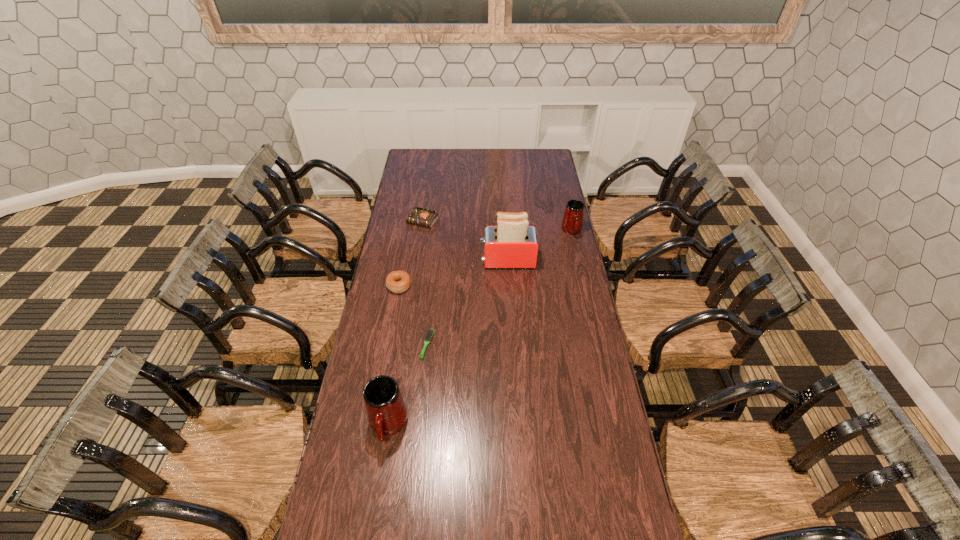
You are a GUI agent. You are given a task and a screenshot of the screen. Output one action in this format:
    pyautogui.click(x=<x>, y=<y>)
    Task: Click on the free spot between the hairbrush and the diary
    
    Given the screenshot: What is the action you would take?
    pyautogui.click(x=424, y=284)

Where is `free space that is in between the left mug and the fourth shortest object`? This screenshot has width=960, height=540. free space that is in between the left mug and the fourth shortest object is located at coordinates (480, 329).

Find the location of `free point between the diary and the third nearest object`. free point between the diary and the third nearest object is located at coordinates (411, 254).

The height and width of the screenshot is (540, 960). I want to click on free space between the shortest object and the fourth nearest object, so tap(468, 303).

Where is `free spot between the rightmost object and the shortest object`? The image size is (960, 540). free spot between the rightmost object and the shortest object is located at coordinates (499, 288).

Image resolution: width=960 pixels, height=540 pixels. Find the location of `vacant area between the third nearest object and the diary`. vacant area between the third nearest object and the diary is located at coordinates (411, 254).

You are a GUI agent. You are given a task and a screenshot of the screen. Output one action in this format:
    pyautogui.click(x=<x>, y=<y>)
    Task: Click on the object that stands as the closest to the second object from right to left
    This screenshot has width=960, height=540.
    Given the screenshot: What is the action you would take?
    pyautogui.click(x=572, y=223)

The image size is (960, 540). I want to click on the closest object relative to the bagel, so click(x=429, y=333).

Identify the location of free spot that satisfies the following two spatial constraints: 1. on the front-facing side of the fifth object from left to right; 2. on the front side of the third nearest object. (509, 286).